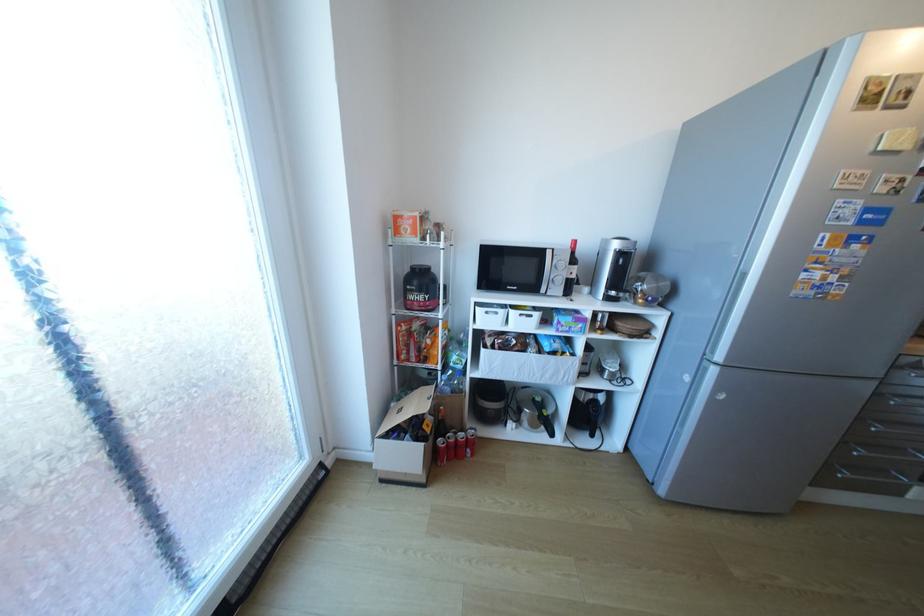
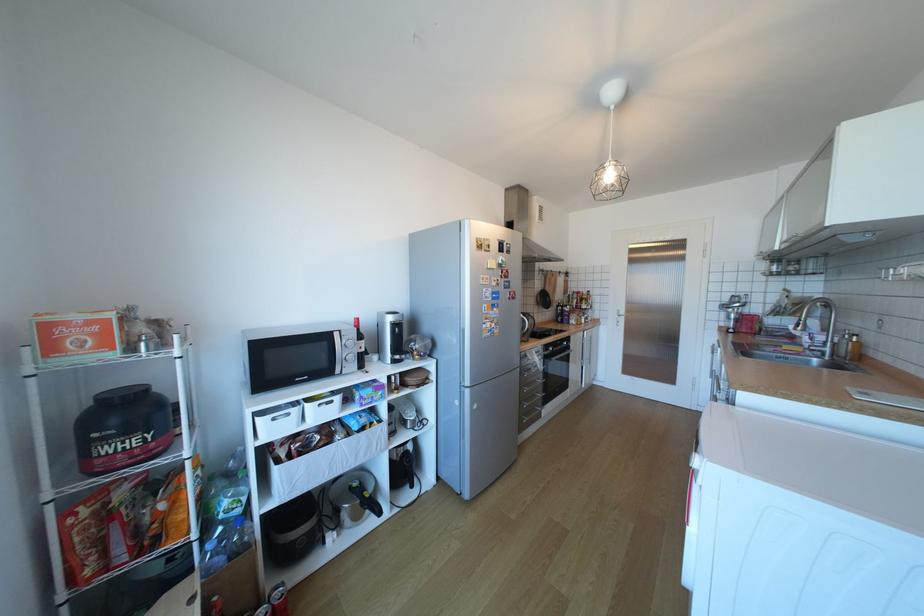
Find the pixel in the second image that matches (726,294) in the first image.

(465, 341)